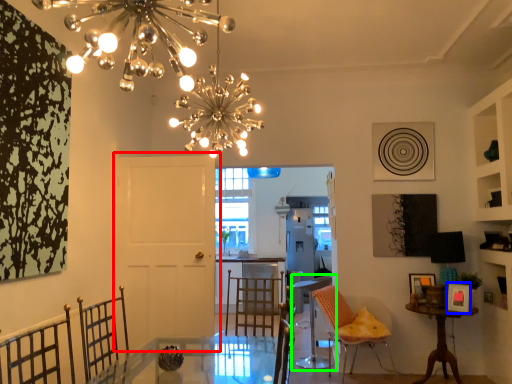
Question: Based on their relative distances, which object is nearer to door (highlighted by a red box)? Choose from picture frame (highlighted by a blue box) and chair (highlighted by a green box).

Choices:
 (A) picture frame
 (B) chair

Answer: (B)